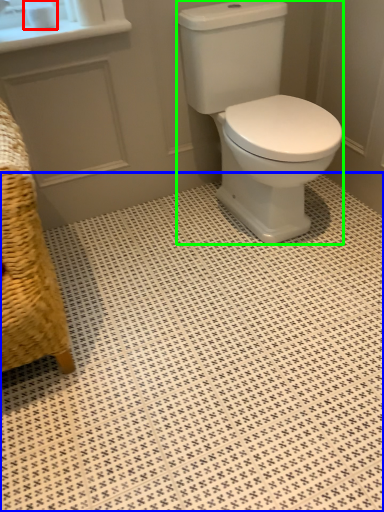
Question: Which object is positioned closest to toilet paper (highlighted by a red box)? Select from ceramic tile (highlighted by a blue box) and porcelain (highlighted by a green box).

Choices:
 (A) ceramic tile
 (B) porcelain

Answer: (B)